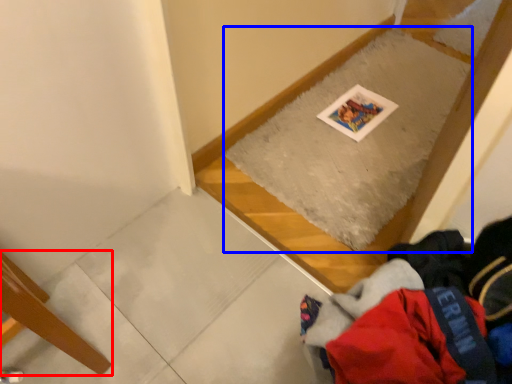
Question: Which point is closer to the camera, furniture (highlighted by a red box) or mat (highlighted by a blue box)?

Choices:
 (A) furniture
 (B) mat

Answer: (A)